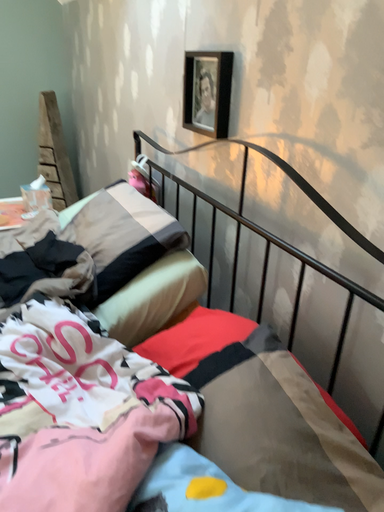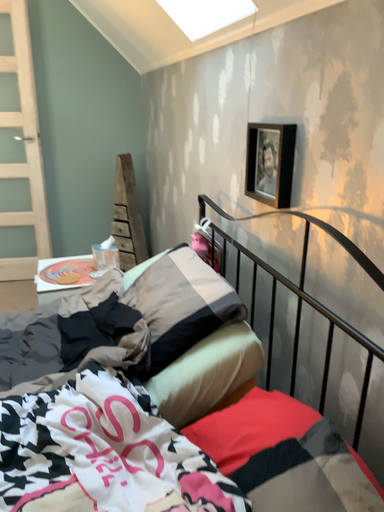
Question: How did the camera likely rotate when shooting the video?

Choices:
 (A) rotated right
 (B) rotated left

Answer: (B)